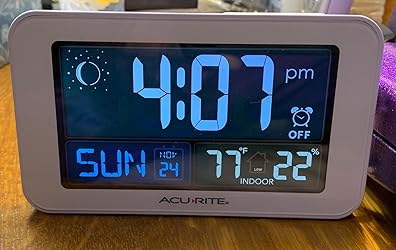
Image resolution: width=396 pixels, height=250 pixels. In order to click on frame in this screenshot , I will do `click(256, 202)`.